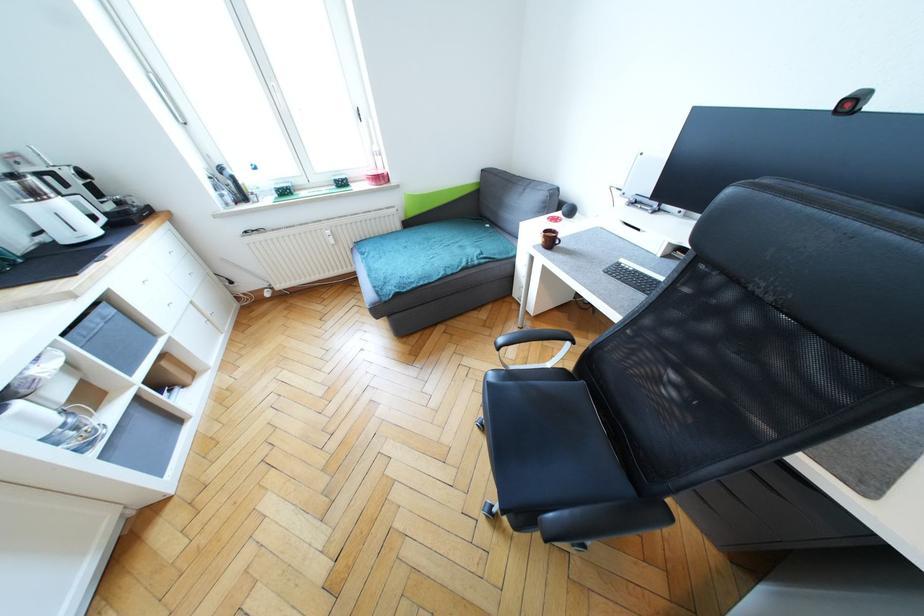
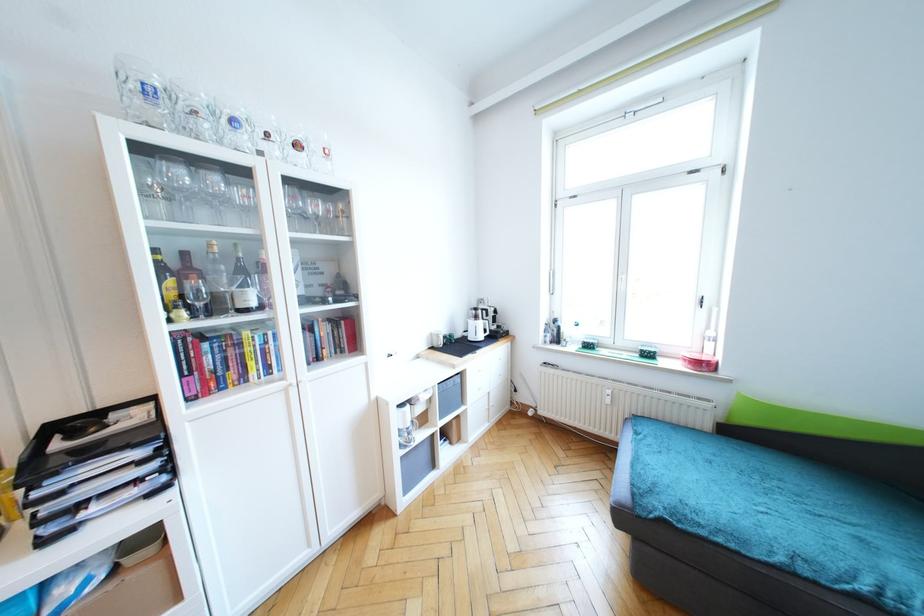
Question: The camera is either moving clockwise (left) or counter-clockwise (right) around the object. The first image is from the beginning of the video and the second image is from the end. Is the camera moving left or right when shooting the video?

Choices:
 (A) Left
 (B) Right

Answer: (B)